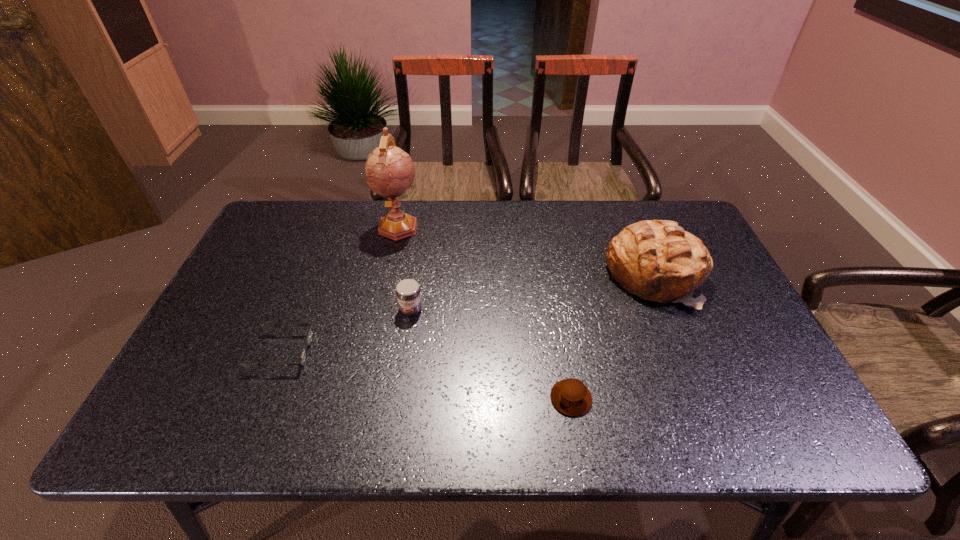
Locate an element on the screen. The height and width of the screenshot is (540, 960). globe is located at coordinates (390, 171).

Find the location of a particular element. Image resolution: width=960 pixels, height=540 pixels. the rightmost object is located at coordinates (657, 260).

Identify the location of bread. The image size is (960, 540). (657, 260).

Locate an element on the screen. the third shortest object is located at coordinates (408, 293).

Locate an element on the screen. the nearest object is located at coordinates (570, 396).

Where is `the second object from right to left`? This screenshot has height=540, width=960. the second object from right to left is located at coordinates (570, 396).

Identify the location of the fourth farthest object. (309, 338).

Locate an element on the screen. The width and height of the screenshot is (960, 540). the leftmost object is located at coordinates (309, 338).

You are a GUI agent. You are given a task and a screenshot of the screen. Output one action in this format:
    pyautogui.click(x=<x>, y=<y>)
    Task: Click on the vacant space situated 0.130m on the front-facing side of the globe
    
    Given the screenshot: What is the action you would take?
    pyautogui.click(x=388, y=274)

The height and width of the screenshot is (540, 960). Identify the location of vacant position located 0.120m on the left of the fourth shortest object. (563, 276).